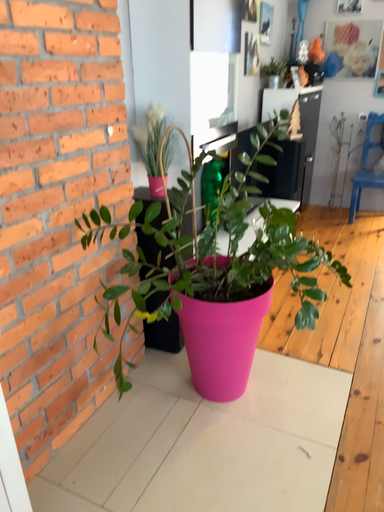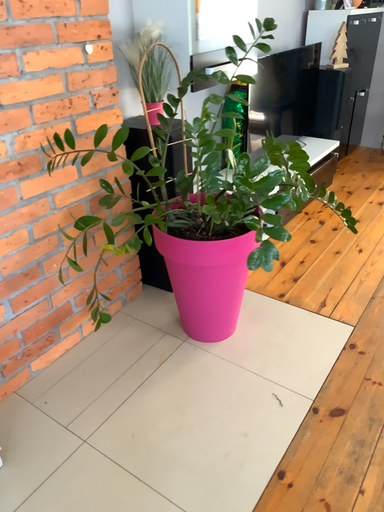
Question: How did the camera likely rotate when shooting the video?

Choices:
 (A) rotated left
 (B) rotated right

Answer: (A)